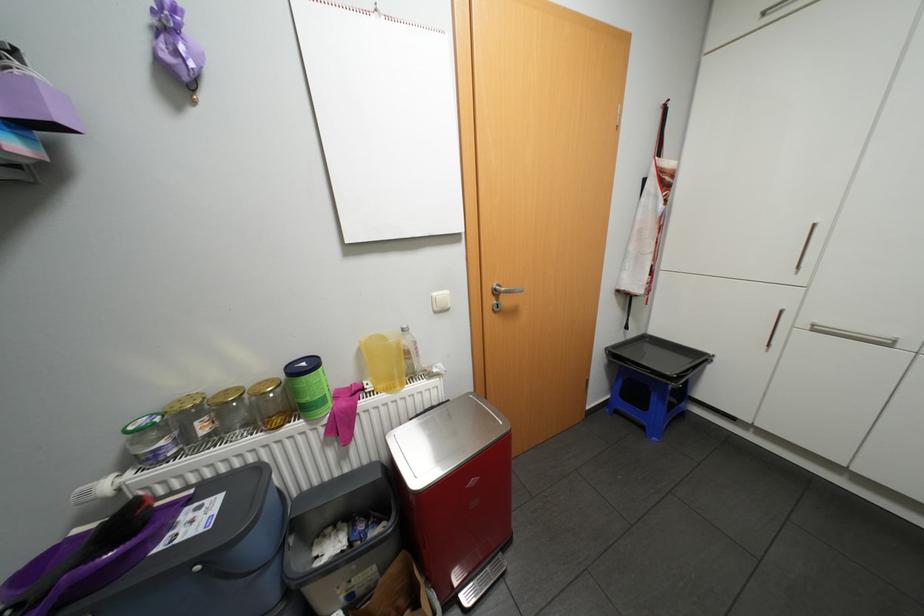
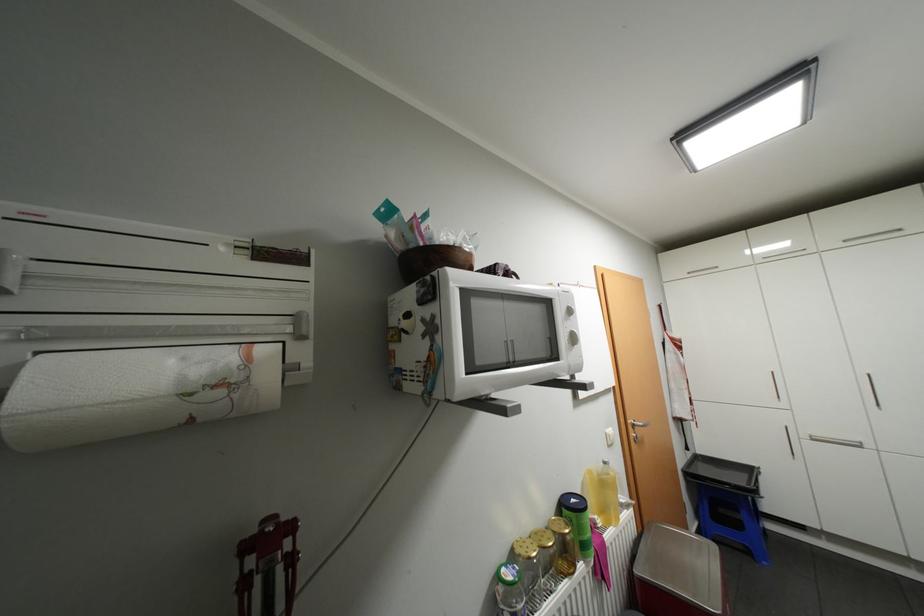
Locate, in the second image, the point that corresponds to point (639, 333) in the first image.

(697, 453)